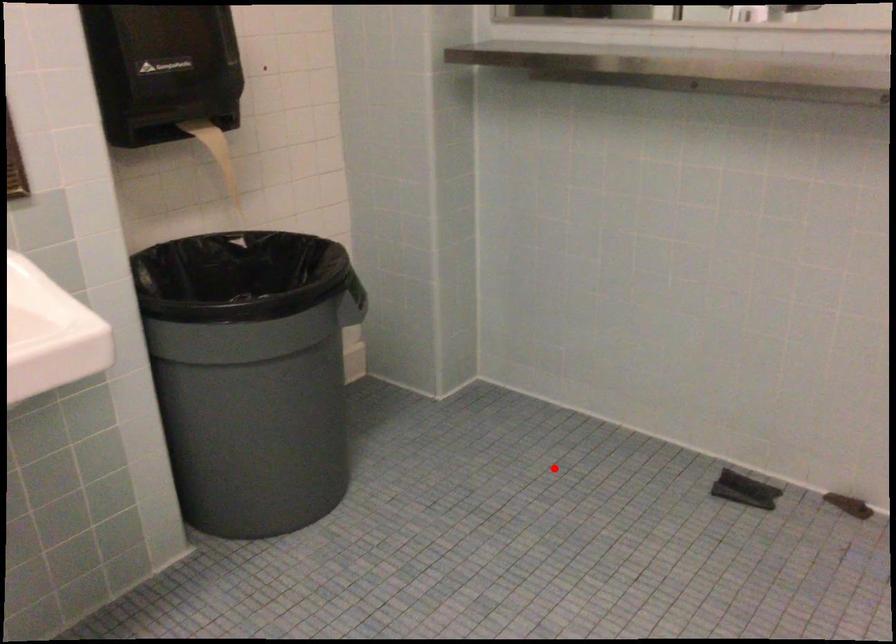
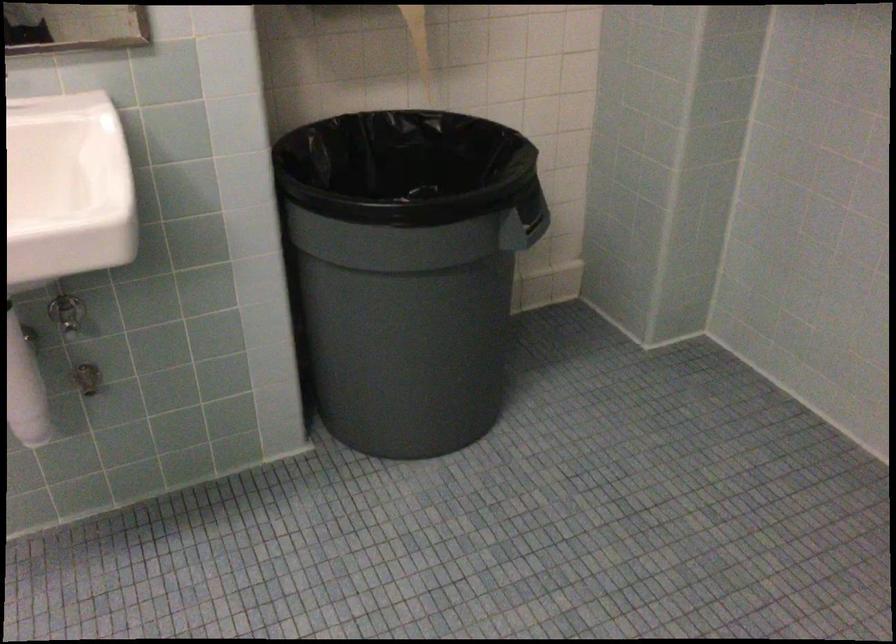
Question: A red point is marked in image1. In image2, is the corresponding 3D point closer to the camera or farther? Reply with the corresponding letter.

Choices:
 (A) The corresponding 3D point is closer.
 (B) The corresponding 3D point is farther.

Answer: (A)